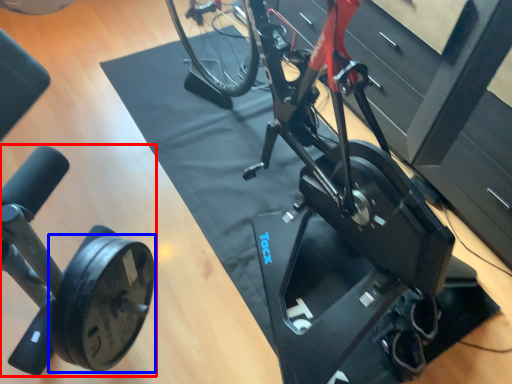
Question: Which object is further to the camera taking this photo, stationary bicycle (highlighted by a red box) or wheel (highlighted by a blue box)?

Choices:
 (A) stationary bicycle
 (B) wheel

Answer: (A)